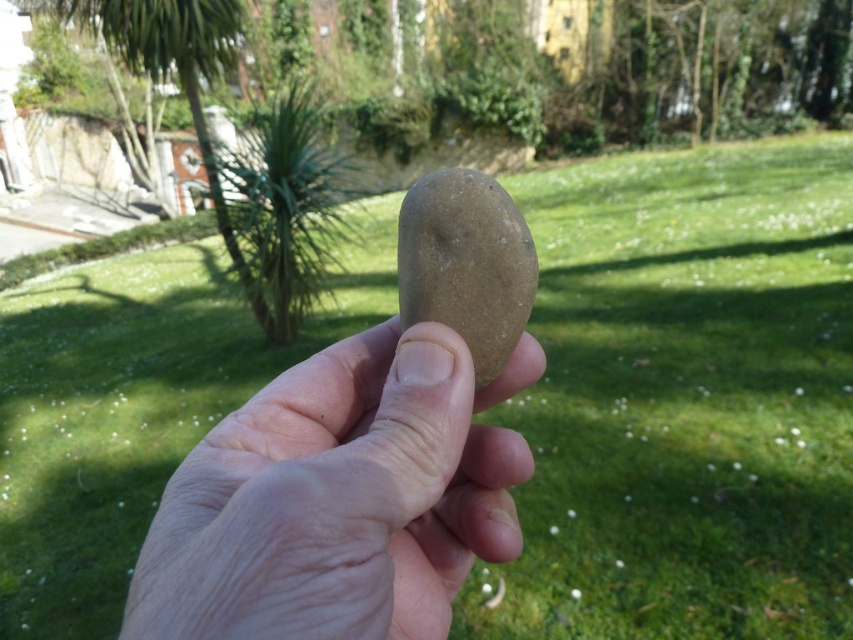
You are a photographer trying to capture the stone in the hand. The camera is positioned at a certain distance from the point specified as point (318, 541). If the camera needs to be within 10 inches to focus clearly, will it be able to focus on that point?

The distance between the camera and point (318, 541) is 12.48 inches, which is beyond the 10 inches required for clear focus. Therefore, the camera will not be able to focus clearly on that point.